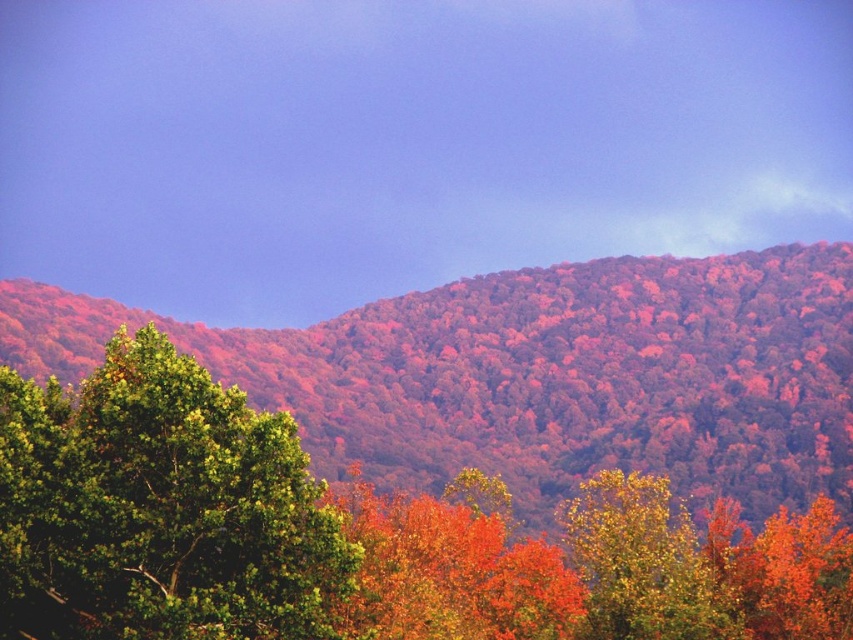
You are an artist planning to paint this autumn landscape. You have a small brush that can only cover areas narrower than the green matte tree at lower left. Can you use this brush to paint the golden yellow leaves at center without needing a larger brush?

The green matte tree at lower left has a lesser width compared to golden yellow leaves at center. Since the golden yellow leaves at center are wider, the small brush that can only cover areas narrower than the green matte tree at lower left would not be sufficient to paint them. You would need a larger brush for the golden yellow leaves at center.

You are standing in an autumn landscape with two points marked. The first point is at coordinates point (402, 483) and the second is at point (607, 600). If you want to reach the point closer to you first, which point should you head towards?

You should head towards point (607, 600) because it is closer to you than point (402, 483), which is further away.